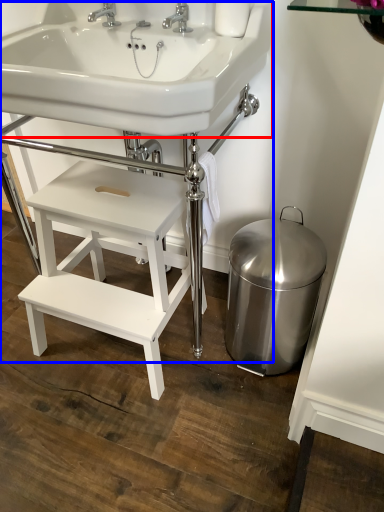
Question: Among these objects, which one is farthest to the camera, sink (highlighted by a red box) or sink (highlighted by a blue box)?

Choices:
 (A) sink
 (B) sink

Answer: (B)